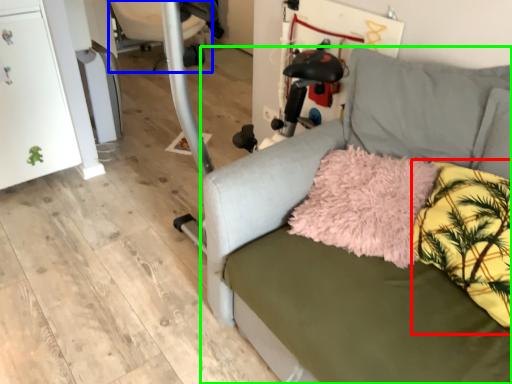
Question: Estimate the real-world distances between objects in this image. Which object is closer to pillow (highlighted by a red box), swivel chair (highlighted by a blue box) or studio couch (highlighted by a green box)?

Choices:
 (A) swivel chair
 (B) studio couch

Answer: (B)